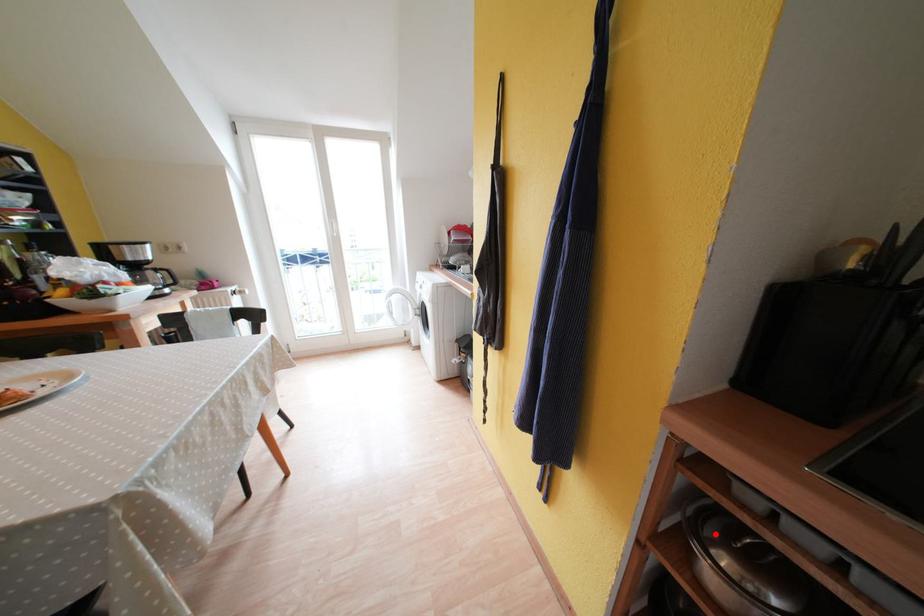
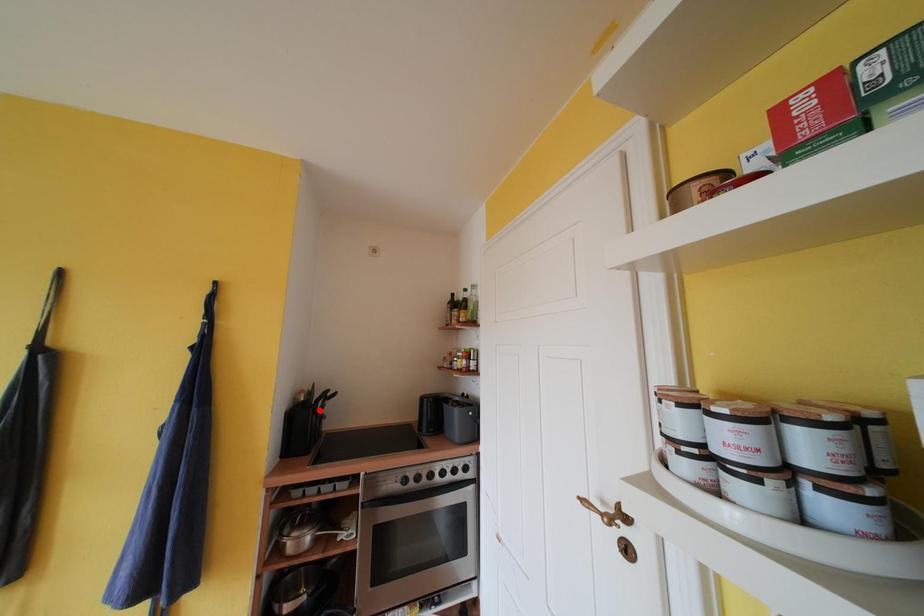
I am providing you with two images of the same scene from different viewpoints. A red point is marked on the first image and another point is marked on the second image. Does the point marked in image1 correspond to the same location as the one in image2?

No